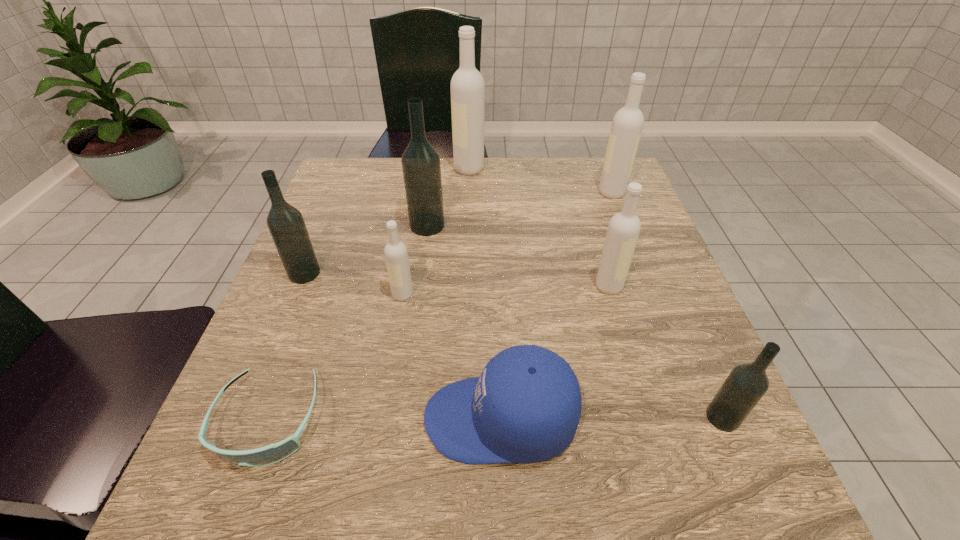
Where is `free point between the shortest object and the farthest vodka`? This screenshot has height=540, width=960. free point between the shortest object and the farthest vodka is located at coordinates [369, 294].

Locate an element on the screen. free area in between the rightmost black vodka and the second nearest black vodka is located at coordinates (514, 346).

Locate an element on the screen. The image size is (960, 540). empty location between the second farthest white vodka and the third farthest object is located at coordinates (519, 209).

You are a GUI agent. You are given a task and a screenshot of the screen. Output one action in this format:
    pyautogui.click(x=<x>, y=<y>)
    Task: Click on the vacant space that is in between the rightmost white vodka and the eighth tallest object
    
    Given the screenshot: What is the action you would take?
    pyautogui.click(x=556, y=306)

Where is `blank region between the leftmost vodka and the goggles`? This screenshot has width=960, height=540. blank region between the leftmost vodka and the goggles is located at coordinates (286, 347).

Find the location of a particular element. Image resolution: width=960 pixels, height=540 pixels. vacant area between the leftmost black vodka and the leftmost white vodka is located at coordinates (353, 284).

The image size is (960, 540). Find the location of `free area in between the second farthest vodka and the leftmost white vodka`. free area in between the second farthest vodka and the leftmost white vodka is located at coordinates (507, 244).

I want to click on object that is the eighth closest to the second biggest white vodka, so click(x=273, y=453).

Image resolution: width=960 pixels, height=540 pixels. Identify the location of the seventh closest object to the goggles. (467, 84).

Identify which vodka is the sixth closest to the third biggest white vodka. Please provide its 2D coordinates. Your answer should be formatted as a tuple, i.e. [(x, y)], where the tuple contains the x and y coordinates of a point satisfying the conditions above.

[(286, 224)]